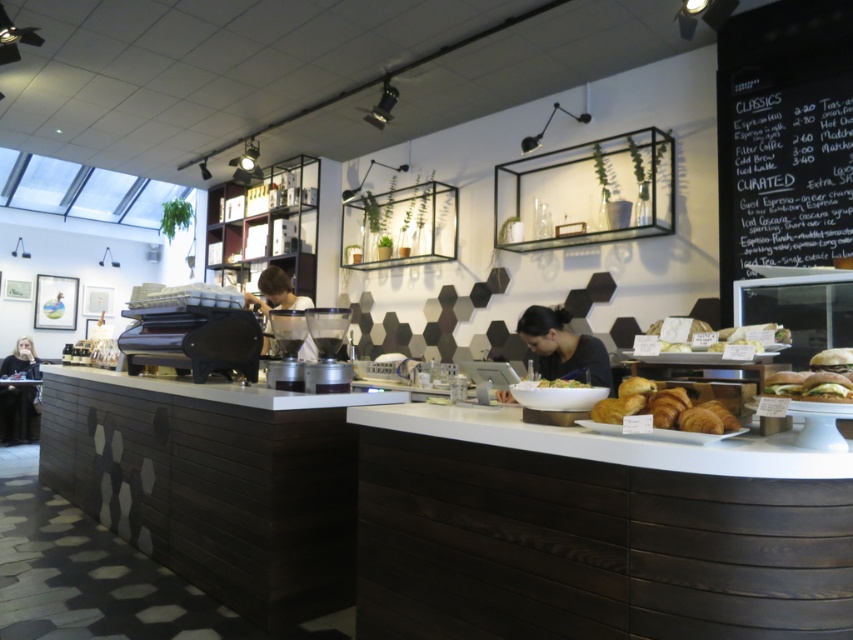
Which of these two, matte black laptop at center or green matte salad bowl at center, stands taller?

matte black laptop at center is taller.

Does matte black laptop at center have a greater width compared to green matte salad bowl at center?

Yes, matte black laptop at center is wider than green matte salad bowl at center.

Which is behind, point (532, 324) or point (564, 378)?

Positioned behind is point (532, 324).

Locate an element on the screen. This screenshot has height=640, width=853. matte black laptop at center is located at coordinates (563, 348).

How much distance is there between matte black coffee machine at center and green matte salad bowl at center?

matte black coffee machine at center and green matte salad bowl at center are 2.13 meters apart.

Based on the photo, is matte black coffee machine at center to the left of green matte salad bowl at center from the viewer's perspective?

Indeed, matte black coffee machine at center is positioned on the left side of green matte salad bowl at center.

Between point (245, 291) and point (561, 387), which one is positioned behind?

Positioned behind is point (245, 291).

I want to click on matte black coffee machine at center, so click(x=276, y=292).

Which is in front, point (851, 65) or point (567, 385)?

Point (567, 385)

Is point (827, 33) closer to viewer compared to point (561, 387)?

That is False.

The height and width of the screenshot is (640, 853). Describe the element at coordinates (782, 138) in the screenshot. I see `black chalkboard at upper right` at that location.

Locate an element on the screen. black chalkboard at upper right is located at coordinates (782, 138).